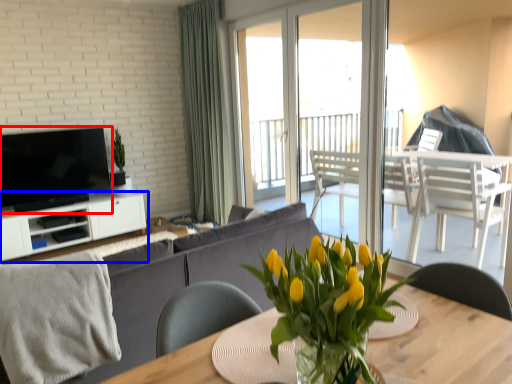
Question: Which point is further to the camera, television (highlighted by a red box) or cabinetry (highlighted by a blue box)?

Choices:
 (A) television
 (B) cabinetry

Answer: (B)